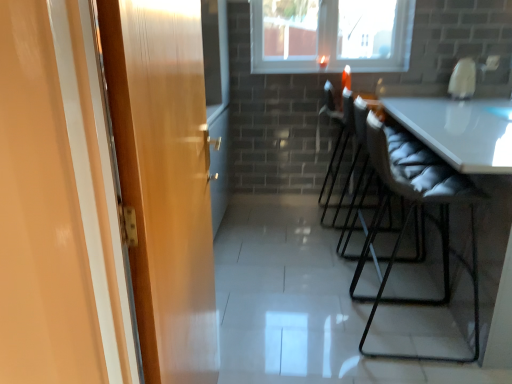
Question: Does black leather chair at center, acting as the third chair starting from the front, lie behind gray quilted cushion at right, the 1th chair positioned from the front?

Choices:
 (A) no
 (B) yes

Answer: (B)

Question: Does black leather chair at center, acting as the 1th chair starting from the back, have a lesser height compared to gray quilted cushion at right, the 1th chair positioned from the front?

Choices:
 (A) no
 (B) yes

Answer: (B)

Question: Is black leather chair at center, acting as the third chair starting from the front, thinner than gray quilted cushion at right, the 1th chair positioned from the front?

Choices:
 (A) yes
 (B) no

Answer: (A)

Question: Can you confirm if black leather chair at center, acting as the 1th chair starting from the back, is wider than gray quilted cushion at right, the 1th chair positioned from the front?

Choices:
 (A) yes
 (B) no

Answer: (B)

Question: Is black leather chair at center, acting as the third chair starting from the front, turned away from gray quilted cushion at right, the 1th chair positioned from the front?

Choices:
 (A) yes
 (B) no

Answer: (B)

Question: Would you say black leather chair at center, acting as the third chair starting from the front, contains gray quilted cushion at right, the 1th chair positioned from the front?

Choices:
 (A) yes
 (B) no

Answer: (B)

Question: Is wooden door at left aimed at gray quilted cushion at right, which appears as the third chair when viewed from the back?

Choices:
 (A) yes
 (B) no

Answer: (B)

Question: Is gray quilted cushion at right, the 1th chair positioned from the front, at the back of wooden door at left?

Choices:
 (A) yes
 (B) no

Answer: (B)

Question: Is wooden door at left next to gray quilted cushion at right, which appears as the third chair when viewed from the back, and touching it?

Choices:
 (A) yes
 (B) no

Answer: (B)

Question: From a real-world perspective, is wooden door at left under gray quilted cushion at right, the 1th chair positioned from the front?

Choices:
 (A) no
 (B) yes

Answer: (A)

Question: Is wooden door at left to the right of gray quilted cushion at right, the 1th chair positioned from the front, from the viewer's perspective?

Choices:
 (A) yes
 (B) no

Answer: (B)

Question: Can you confirm if wooden door at left is wider than gray quilted cushion at right, which appears as the third chair when viewed from the back?

Choices:
 (A) yes
 (B) no

Answer: (B)

Question: Is matte gray chair at center right, positioned as the 2th chair in back-to-front order, outside of black leather chair at center, acting as the third chair starting from the front?

Choices:
 (A) no
 (B) yes

Answer: (B)